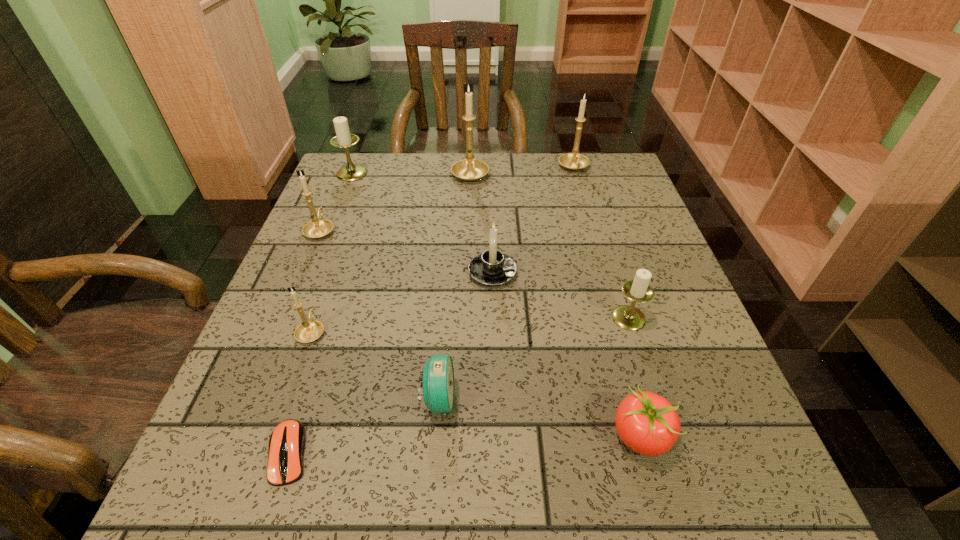
Locate an element on the screen. empty space that is in between the shortest object and the tallest object is located at coordinates (380, 313).

Locate an element on the screen. This screenshot has height=540, width=960. free space between the tomato and the farther white candle holder is located at coordinates (496, 305).

Find the location of a particular element. Image resolution: width=960 pixels, height=540 pixels. free space that is in between the alarm clock and the sixth nearest object is located at coordinates (466, 336).

The image size is (960, 540). I want to click on the ninth closest object relative to the blue alarm clock, so click(573, 161).

What are the coordinates of `object that is the closest to the third farthest gold candle holder` in the screenshot? It's located at pos(343,139).

Identify which candle holder is located as the second nearest to the tallest object. Please provide its 2D coordinates. Your answer should be formatted as a tuple, i.e. [(x, y)], where the tuple contains the x and y coordinates of a point satisfying the conditions above.

[(343, 139)]

Identify which candle holder is located as the second nearest to the red tomato. Please provide its 2D coordinates. Your answer should be formatted as a tuple, i.e. [(x, y)], where the tuple contains the x and y coordinates of a point satisfying the conditions above.

[(491, 268)]

This screenshot has height=540, width=960. Identify the location of gold candle holder that can be found as the third closest to the leftmost gold candle holder. (573, 161).

Locate which gold candle holder ranks in proximity to the fifth farthest candle holder. Please provide its 2D coordinates. Your answer should be formatted as a tuple, i.e. [(x, y)], where the tuple contains the x and y coordinates of a point satisfying the conditions above.

[(308, 331)]

Find the location of `free region that satisfies the following two spatial constraints: 1. on the handle side of the nearest gold candle holder; 2. on the right side of the nearer white candle holder`. free region that satisfies the following two spatial constraints: 1. on the handle side of the nearest gold candle holder; 2. on the right side of the nearer white candle holder is located at coordinates (316, 318).